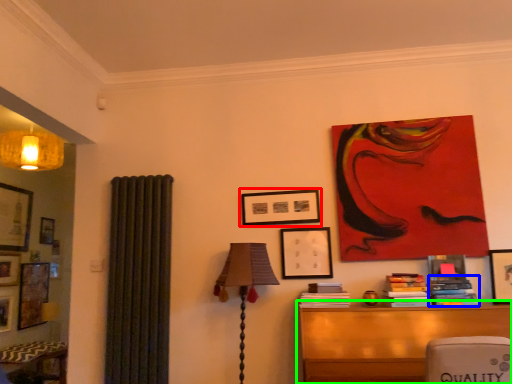
Question: Estimate the real-world distances between objects in this image. Which object is farther from picture frame (highlighted by a red box), book (highlighted by a blue box) or table (highlighted by a green box)?

Choices:
 (A) book
 (B) table

Answer: (A)